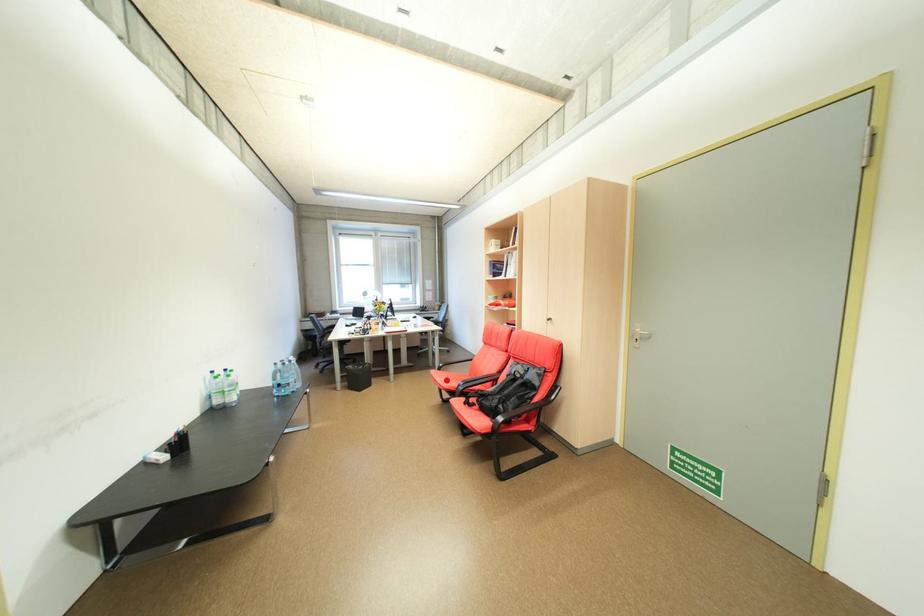
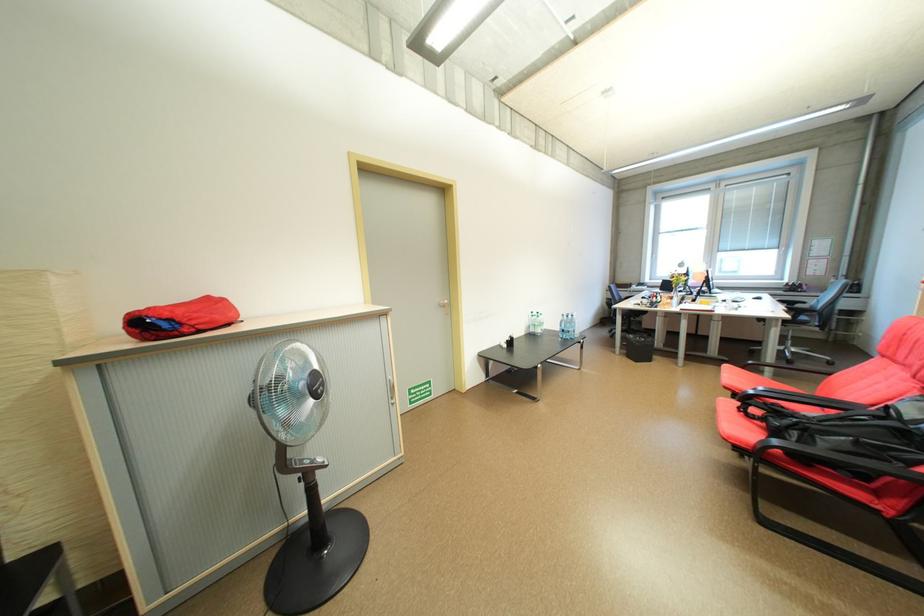
Question: I am providing you with two images of the same scene from different viewpoints. Image1 has a red point marked. In image2, the corresponding 3D location appears at what relative position? Reply with the corresponding letter.

Choices:
 (A) Closer
 (B) Farther

Answer: (B)